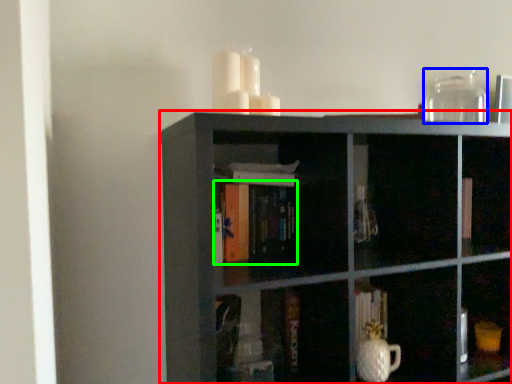
Question: Estimate the real-world distances between objects in this image. Which object is closer to shelf (highlighted by a red box), glass vase (highlighted by a blue box) or book (highlighted by a green box)?

Choices:
 (A) glass vase
 (B) book

Answer: (B)